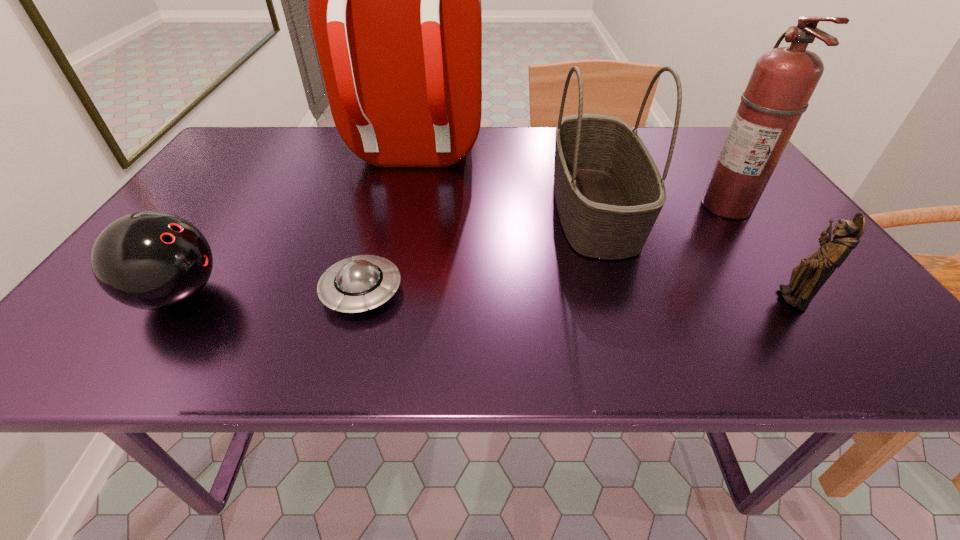
The width and height of the screenshot is (960, 540). Identify the location of free space located 0.280m on the front-facing side of the fire extinguisher. (586, 207).

This screenshot has width=960, height=540. In order to click on free space located on the back of the basket in this screenshot , I will do `click(572, 138)`.

Find the location of a particular element. The width and height of the screenshot is (960, 540). vacant space located on the front-facing side of the figurine is located at coordinates (708, 299).

At what (x,y) coordinates should I click in order to perform the action: click on free space located on the front-facing side of the figurine. Please return your answer as a coordinate pair (x, y). The width and height of the screenshot is (960, 540). Looking at the image, I should click on (562, 299).

The height and width of the screenshot is (540, 960). I want to click on free region located on the front-facing side of the figurine, so click(677, 299).

The image size is (960, 540). Identify the location of blank space located on the surface of the bowling ball near the finger holes. (369, 295).

Where is `vacant space located 0.390m on the back of the shortest object`? The width and height of the screenshot is (960, 540). vacant space located 0.390m on the back of the shortest object is located at coordinates (395, 168).

Locate an element on the screen. backpack that is positioned at the far edge is located at coordinates (394, 0).

At what (x,y) coordinates should I click in order to perform the action: click on basket at the far edge. Please return your answer as a coordinate pair (x, y). The width and height of the screenshot is (960, 540). Looking at the image, I should click on (609, 192).

The width and height of the screenshot is (960, 540). I want to click on object at the near edge, so click(x=150, y=260).